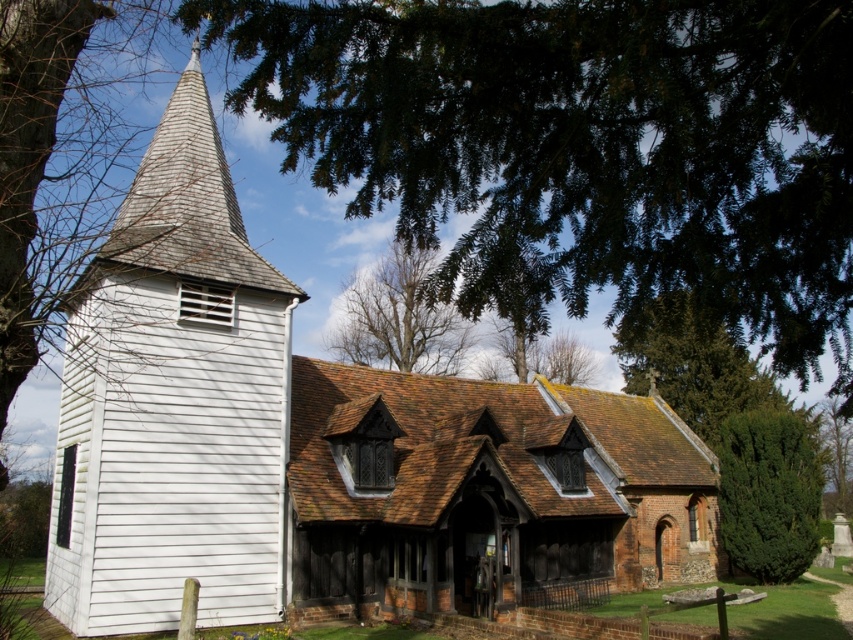
Question: Is green textured bush at right positioned at the back of bare branches at center?

Choices:
 (A) yes
 (B) no

Answer: (A)

Question: Does green leafy tree at upper center appear under green leafy tree at right?

Choices:
 (A) no
 (B) yes

Answer: (A)

Question: Based on their relative distances, which object is nearer to the white wooden chapel at left?

Choices:
 (A) green textured bush at right
 (B) green leafy tree at right
 (C) green leafy tree at upper center
 (D) bare branches at center

Answer: (C)

Question: Which object is farther from the camera taking this photo?

Choices:
 (A) green leafy tree at right
 (B) white wooden chapel at left

Answer: (A)

Question: Estimate the real-world distances between objects in this image. Which object is closer to the bare branches at center?

Choices:
 (A) white wooden chapel at left
 (B) green leafy tree at right
 (C) green textured bush at right

Answer: (A)

Question: Is green leafy tree at upper center to the left of green textured bush at right from the viewer's perspective?

Choices:
 (A) no
 (B) yes

Answer: (B)